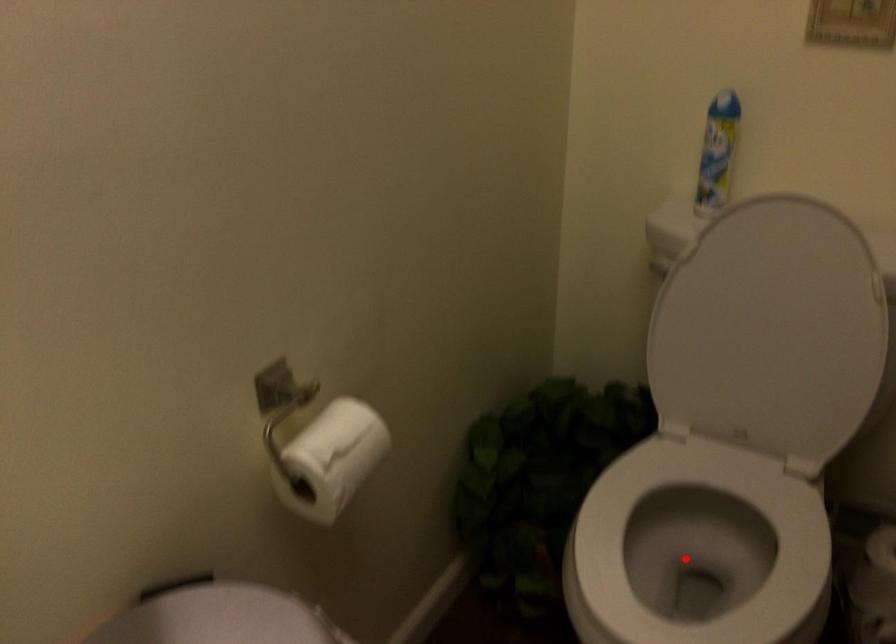
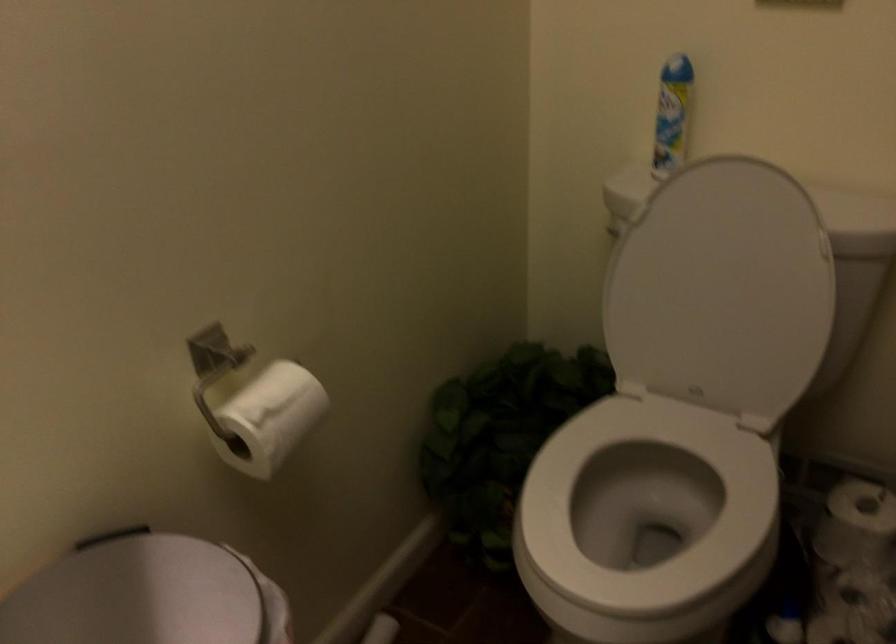
Question: I am providing you with two images of the same scene from different viewpoints. A red point is marked on the first image. Is the red point's position out of view in image 2?

Choices:
 (A) Yes
 (B) No

Answer: (B)